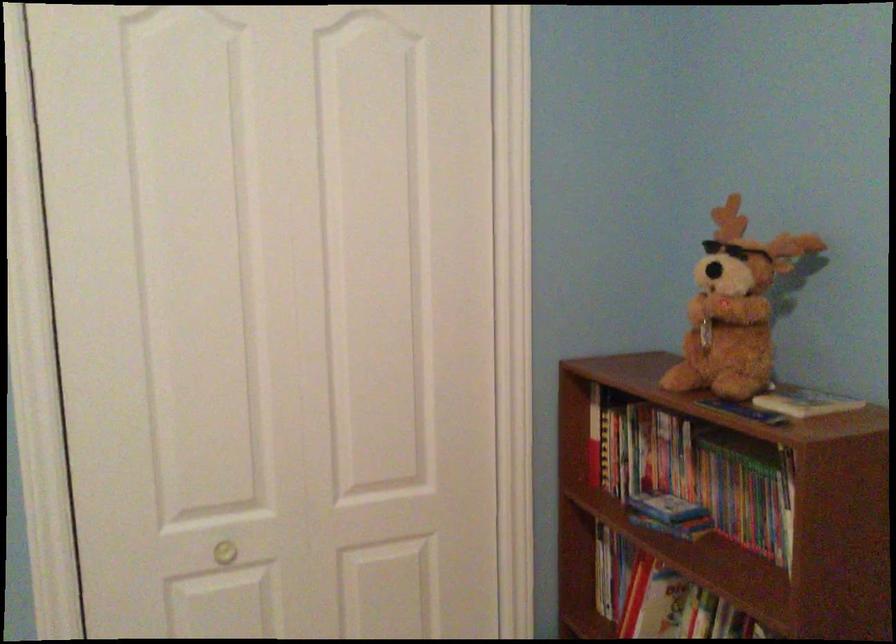
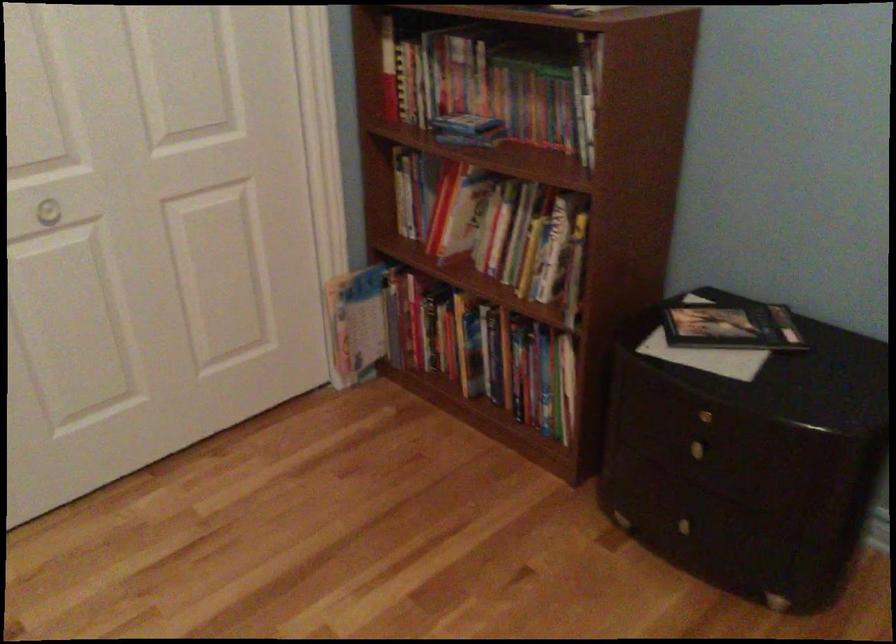
The point at (756,498) is marked in the first image. Where is the corresponding point in the second image?

(545, 102)